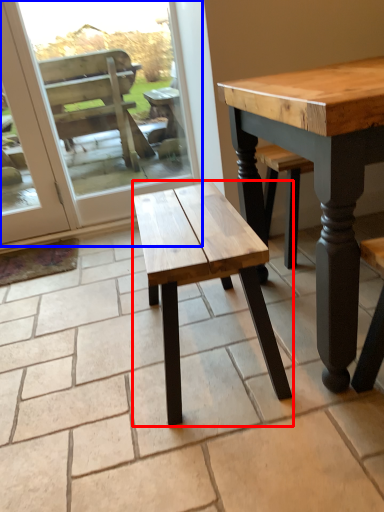
Question: Which of the following is the closest to the observer, stool (highlighted by a red box) or screen door (highlighted by a blue box)?

Choices:
 (A) stool
 (B) screen door

Answer: (A)